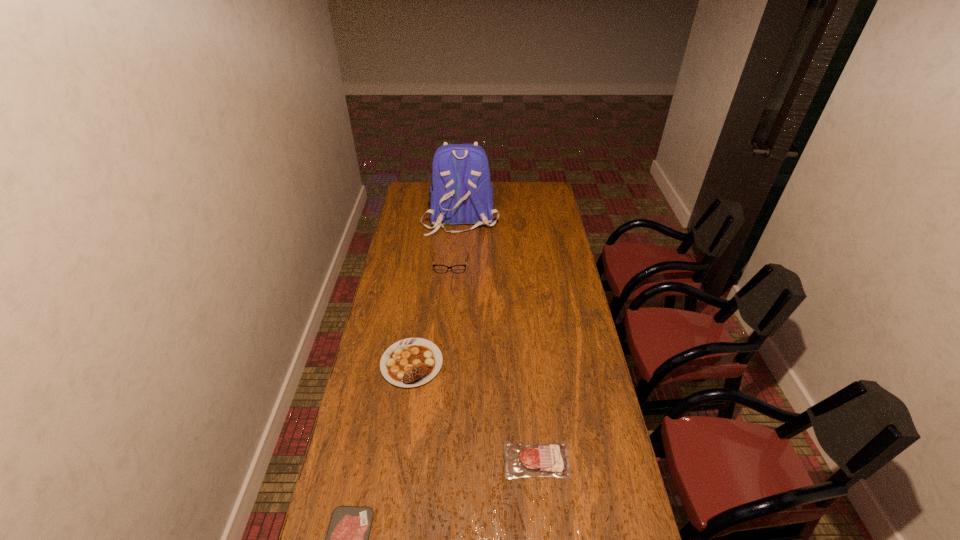
The height and width of the screenshot is (540, 960). I want to click on the tallest object, so click(462, 193).

Where is `backpack`? Image resolution: width=960 pixels, height=540 pixels. backpack is located at coordinates (462, 193).

Find the location of a particular element. spectacles is located at coordinates (438, 268).

This screenshot has height=540, width=960. Find the location of `the tallest steak`. the tallest steak is located at coordinates (411, 362).

Where is `the third nearest object`? the third nearest object is located at coordinates (411, 362).

You are a GUI agent. You are given a task and a screenshot of the screen. Output one action in this format:
    pyautogui.click(x=<x>, y=<y>)
    Task: Click on the second nearest steak
    The height and width of the screenshot is (540, 960).
    Given the screenshot: What is the action you would take?
    pyautogui.click(x=551, y=459)

What are the coordinates of `the fourth farthest object` in the screenshot? It's located at (551, 459).

I want to click on vacant space located on the back of the farthest object, so 458,266.

Where is `vacant space located 0.260m on the front-facing side of the fourth nearest object`? vacant space located 0.260m on the front-facing side of the fourth nearest object is located at coordinates (446, 312).

The height and width of the screenshot is (540, 960). In order to click on free location located on the right of the third nearest object in this screenshot , I will do `click(499, 363)`.